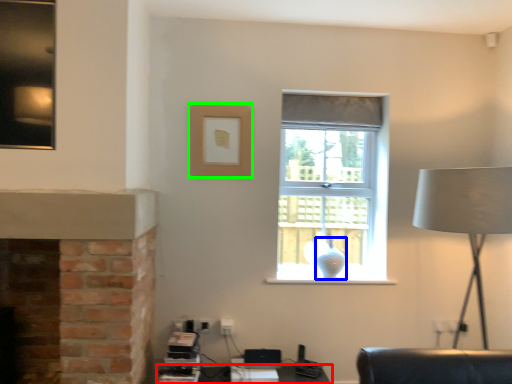
Question: Estimate the real-world distances between objects in this image. Which object is farther from table (highlighted by a red box), glass vase (highlighted by a blue box) or picture frame (highlighted by a green box)?

Choices:
 (A) glass vase
 (B) picture frame

Answer: (B)